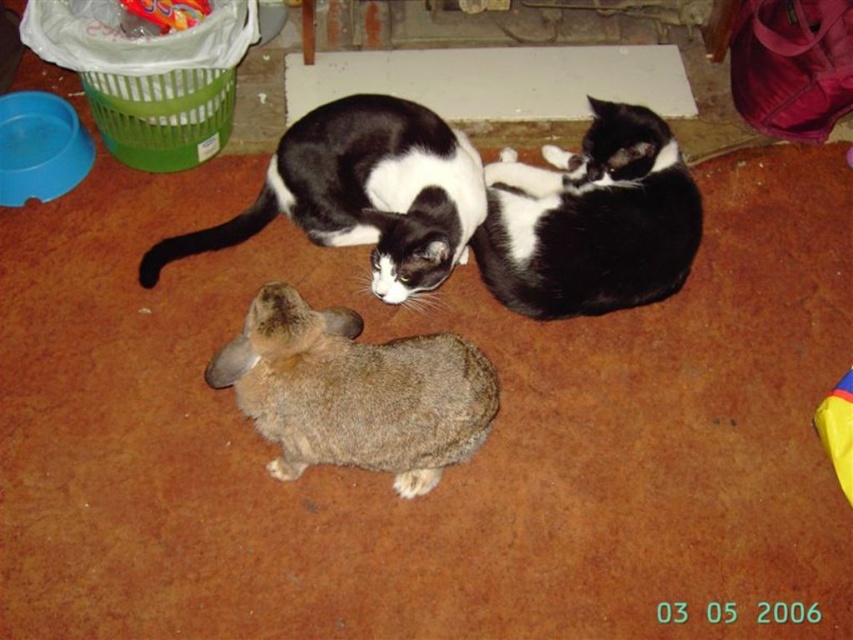
Question: Which point appears farthest from the camera in this image?

Choices:
 (A) pos(276,180)
 (B) pos(410,444)
 (C) pos(682,209)

Answer: (A)

Question: Does fuzzy brown rabbit at center have a greater width compared to black and white fur cat at center?

Choices:
 (A) no
 (B) yes

Answer: (B)

Question: Which object is the closest to the black and white fur cat at upper center?

Choices:
 (A) black and white fur cat at center
 (B) fuzzy brown rabbit at center

Answer: (A)

Question: Is fuzzy brown rabbit at center below black and white fur cat at upper center?

Choices:
 (A) no
 (B) yes

Answer: (B)

Question: Considering the relative positions of fuzzy brown rabbit at center and black and white fur cat at center in the image provided, where is fuzzy brown rabbit at center located with respect to black and white fur cat at center?

Choices:
 (A) left
 (B) right

Answer: (A)

Question: Which of the following is the closest to the observer?

Choices:
 (A) (474, 163)
 (B) (451, 435)
 (C) (631, 276)

Answer: (B)